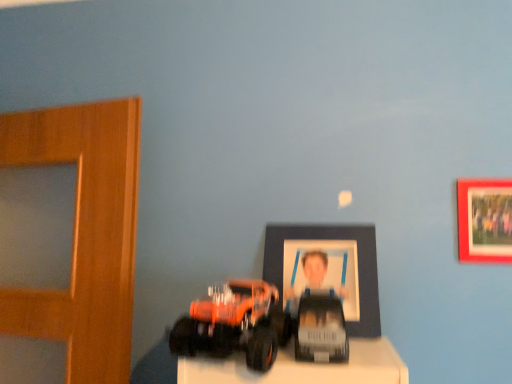
Question: Considering the relative sizes of matte red picture frame at upper right, which is the first picture frame from right to left, and orange matte truck at lower left, which is the 2th toy from right to left, in the image provided, is matte red picture frame at upper right, which is the first picture frame from right to left, taller than orange matte truck at lower left, which is the 2th toy from right to left,?

Choices:
 (A) yes
 (B) no

Answer: (A)

Question: From a real-world perspective, is matte red picture frame at upper right, which is the 2th picture frame in left-to-right order, physically below orange matte truck at lower left, which ranks as the 1th toy in left-to-right order?

Choices:
 (A) yes
 (B) no

Answer: (B)

Question: Considering the relative sizes of matte red picture frame at upper right, which is the 2th picture frame in left-to-right order, and orange matte truck at lower left, which is the 2th toy from right to left, in the image provided, is matte red picture frame at upper right, which is the 2th picture frame in left-to-right order, thinner than orange matte truck at lower left, which is the 2th toy from right to left,?

Choices:
 (A) no
 (B) yes

Answer: (B)

Question: Can you confirm if matte red picture frame at upper right, which is the first picture frame from right to left, is bigger than orange matte truck at lower left, which ranks as the 1th toy in left-to-right order?

Choices:
 (A) yes
 (B) no

Answer: (B)

Question: Would you say matte red picture frame at upper right, which is the first picture frame from right to left, is outside orange matte truck at lower left, which ranks as the 1th toy in left-to-right order?

Choices:
 (A) no
 (B) yes

Answer: (B)

Question: Does matte red picture frame at upper right, which is the first picture frame from right to left, lie behind orange matte truck at lower left, which ranks as the 1th toy in left-to-right order?

Choices:
 (A) no
 (B) yes

Answer: (B)

Question: Is matte plastic picture frame at center, placed as the 1th picture frame when sorted from left to right, positioned behind matte red picture frame at upper right, which is the first picture frame from right to left?

Choices:
 (A) no
 (B) yes

Answer: (B)

Question: From the image's perspective, is matte plastic picture frame at center, placed as the 1th picture frame when sorted from left to right, above matte red picture frame at upper right, which is the 2th picture frame in left-to-right order?

Choices:
 (A) yes
 (B) no

Answer: (B)

Question: From a real-world perspective, is matte plastic picture frame at center, placed as the 1th picture frame when sorted from left to right, beneath matte red picture frame at upper right, which is the first picture frame from right to left?

Choices:
 (A) no
 (B) yes

Answer: (B)

Question: Can matte red picture frame at upper right, which is the 2th picture frame in left-to-right order, be found inside matte plastic picture frame at center, which is the 2th picture frame from right to left?

Choices:
 (A) no
 (B) yes

Answer: (A)

Question: Is matte plastic picture frame at center, which is the 2th picture frame from right to left, smaller than matte red picture frame at upper right, which is the 2th picture frame in left-to-right order?

Choices:
 (A) no
 (B) yes

Answer: (A)

Question: Does matte plastic picture frame at center, which is the 2th picture frame from right to left, have a greater width compared to matte red picture frame at upper right, which is the first picture frame from right to left?

Choices:
 (A) no
 (B) yes

Answer: (B)

Question: From a real-world perspective, is matte red picture frame at upper right, which is the first picture frame from right to left, positioned over matte plastic picture frame at center, placed as the 1th picture frame when sorted from left to right, based on gravity?

Choices:
 (A) no
 (B) yes

Answer: (B)